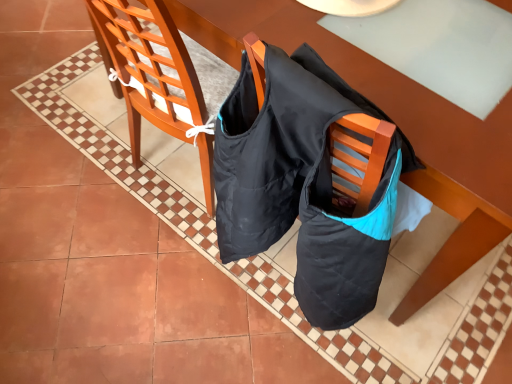
Question: From the image's perspective, would you say matte wood chair at left is positioned over matte wood table at center?

Choices:
 (A) no
 (B) yes

Answer: (A)

Question: From a real-world perspective, is matte wood chair at left physically above matte wood table at center?

Choices:
 (A) yes
 (B) no

Answer: (A)

Question: Is matte wood chair at left wider than matte wood table at center?

Choices:
 (A) no
 (B) yes

Answer: (A)

Question: Can you confirm if matte wood chair at left is bigger than matte wood table at center?

Choices:
 (A) yes
 (B) no

Answer: (B)

Question: Considering the relative positions of matte wood chair at left and matte wood table at center in the image provided, is matte wood chair at left behind matte wood table at center?

Choices:
 (A) yes
 (B) no

Answer: (B)

Question: Is matte wood chair at left at the right side of matte wood table at center?

Choices:
 (A) yes
 (B) no

Answer: (B)

Question: From the image's perspective, does matte wood table at center appear higher than matte wood chair at left?

Choices:
 (A) no
 (B) yes

Answer: (B)

Question: Considering the relative positions of matte wood table at center and matte wood chair at left in the image provided, is matte wood table at center to the left of matte wood chair at left from the viewer's perspective?

Choices:
 (A) yes
 (B) no

Answer: (B)

Question: Is matte wood table at center looking in the opposite direction of matte wood chair at left?

Choices:
 (A) no
 (B) yes

Answer: (B)

Question: Can you confirm if matte wood table at center is taller than matte wood chair at left?

Choices:
 (A) no
 (B) yes

Answer: (A)

Question: Is matte wood table at center thinner than matte wood chair at left?

Choices:
 (A) no
 (B) yes

Answer: (A)

Question: Is matte wood table at center to the right of matte wood chair at left from the viewer's perspective?

Choices:
 (A) yes
 (B) no

Answer: (A)

Question: Is matte wood chair at left taller or shorter than matte wood table at center?

Choices:
 (A) short
 (B) tall

Answer: (B)